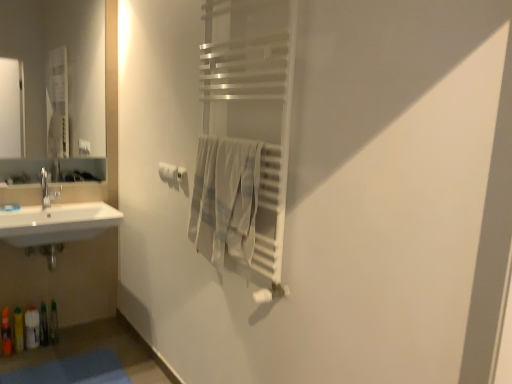
This screenshot has height=384, width=512. I want to click on vacant region above blue fabric bath mat at lower left (from a real-world perspective), so click(x=71, y=371).